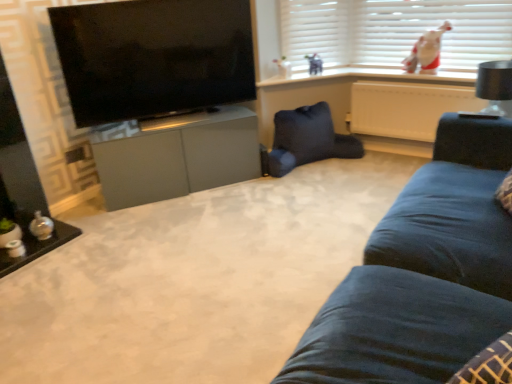
Looking at this image, measure the distance between point [370,45] and camera.

A distance of 3.30 meters exists between point [370,45] and camera.

What do you see at coordinates (153, 57) in the screenshot? I see `black glossy tv at upper left` at bounding box center [153, 57].

This screenshot has width=512, height=384. Describe the element at coordinates (178, 157) in the screenshot. I see `matte gray cabinet at center` at that location.

What do you see at coordinates (318, 31) in the screenshot? The width and height of the screenshot is (512, 384). I see `white matte shutter at upper center` at bounding box center [318, 31].

What are the coordinates of `white matte window blind at upper right` in the screenshot? It's located at (394, 31).

Is white plush toy at upper right to the left of white plastic radiator at upper right from the viewer's perspective?

Incorrect, white plush toy at upper right is not on the left side of white plastic radiator at upper right.

From the picture: From a real-world perspective, is white plush toy at upper right under white plastic radiator at upper right?

No, from a real-world perspective, white plush toy at upper right is not below white plastic radiator at upper right.

Based on the photo, considering the positions of objects white plush toy at upper right and white plastic radiator at upper right in the image provided, who is in front, white plush toy at upper right or white plastic radiator at upper right?

Positioned in front is white plastic radiator at upper right.

Can you tell me how much white plush toy at upper right and white plastic radiator at upper right differ in facing direction?

white plush toy at upper right and white plastic radiator at upper right are facing 0.00277 degrees away from each other.

Is white matte window blind at upper right next to black glossy tv at upper left?

No, white matte window blind at upper right is not in contact with black glossy tv at upper left.

Is white matte window blind at upper right taller or shorter than black glossy tv at upper left?

white matte window blind at upper right is shorter than black glossy tv at upper left.

Which of these two, white matte window blind at upper right or black glossy tv at upper left, is wider?

white matte window blind at upper right.

Is the depth of white matte window blind at upper right greater than that of black glossy tv at upper left?

Yes, the depth of white matte window blind at upper right is greater than that of black glossy tv at upper left.

Considering the positions of points (182, 91) and (352, 47), is point (182, 91) closer to camera compared to point (352, 47)?

Yes, point (182, 91) is in front of point (352, 47).

Looking at this image, are black glossy tv at upper left and white matte shutter at upper center making contact?

No, black glossy tv at upper left is not beside white matte shutter at upper center.

Can you confirm if black glossy tv at upper left is bigger than white matte shutter at upper center?

Indeed, black glossy tv at upper left has a larger size compared to white matte shutter at upper center.

Can you tell me how much black glossy tv at upper left and white matte shutter at upper center differ in facing direction?

black glossy tv at upper left and white matte shutter at upper center are facing 11.7 degrees away from each other.

Is white plush toy at upper right surrounded by black matte lampshade at upper right?

That's incorrect, white plush toy at upper right is not inside black matte lampshade at upper right.

Is point (475, 92) closer to camera compared to point (405, 62)?

Yes, it is in front of point (405, 62).

From a real-world perspective, who is located lower, black matte lampshade at upper right or white plush toy at upper right?

black matte lampshade at upper right, from a real-world perspective.

Where is `lamp that is in front of the matte gray cabinet at center`? The image size is (512, 384). lamp that is in front of the matte gray cabinet at center is located at coordinates (494, 85).

Considering the sizes of black matte lampshade at upper right and matte gray cabinet at center in the image, is black matte lampshade at upper right taller or shorter than matte gray cabinet at center?

Clearly, black matte lampshade at upper right is shorter compared to matte gray cabinet at center.

Consider the image. Is black matte lampshade at upper right completely or partially outside of matte gray cabinet at center?

Absolutely, black matte lampshade at upper right is external to matte gray cabinet at center.

Does black matte lampshade at upper right turn towards matte gray cabinet at center?

Yes, black matte lampshade at upper right is facing matte gray cabinet at center.

I want to click on lamp below the white plush toy at upper right (from a real-world perspective), so click(494, 85).

Considering the sizes of white plush toy at upper right and black matte lampshade at upper right in the image, is white plush toy at upper right bigger or smaller than black matte lampshade at upper right?

In the image, white plush toy at upper right appears to be smaller than black matte lampshade at upper right.

Considering the sizes of objects white plush toy at upper right and black matte lampshade at upper right in the image provided, who is thinner, white plush toy at upper right or black matte lampshade at upper right?

white plush toy at upper right.

Is white plush toy at upper right shorter than black matte lampshade at upper right?

In fact, white plush toy at upper right may be taller than black matte lampshade at upper right.

How many degrees apart are the facing directions of black glossy tv at upper left and white plush toy at upper right?

They differ by 56.2 degrees in their facing directions.

From the picture: Which object is more forward, black glossy tv at upper left or white plush toy at upper right?

black glossy tv at upper left is closer to the camera.

From a real-world perspective, is black glossy tv at upper left physically below white plush toy at upper right?

No, from a real-world perspective, black glossy tv at upper left is not under white plush toy at upper right.

Find the location of a particular element. person that is on the right side of white plastic radiator at upper right is located at coordinates (426, 51).

Where is `window blind that appears behind the black glossy tv at upper left`? This screenshot has width=512, height=384. window blind that appears behind the black glossy tv at upper left is located at coordinates (394, 31).

When comparing their distances from white plush toy at upper right, does black matte lampshade at upper right or white matte shutter at upper center seem closer?

black matte lampshade at upper right is positioned closer to the anchor white plush toy at upper right.

Based on their spatial positions, is white matte shutter at upper center or white matte window blind at upper right closer to white plush toy at upper center?

white matte shutter at upper center is closer to white plush toy at upper center.

From the image, which object appears to be farther from white matte window blind at upper right, white matte shutter at upper center or white plush toy at upper right?

Among the two, white plush toy at upper right is located further to white matte window blind at upper right.

Looking at the image, which one is located closer to black glossy tv at upper left, white plush toy at upper right or white matte shutter at upper center?

white matte shutter at upper center is closer to black glossy tv at upper left.

From the image, which object appears to be nearer to black glossy tv at upper left, white matte window blind at upper right or white plush toy at upper right?

white matte window blind at upper right is closer to black glossy tv at upper left.

Estimate the real-world distances between objects in this image. Which object is closer to dark blue fabric swivel chair at center, white plush toy at upper right or black matte lampshade at upper right?

Based on the image, white plush toy at upper right appears to be nearer to dark blue fabric swivel chair at center.

Estimate the real-world distances between objects in this image. Which object is closer to white plastic radiator at upper right, white plush toy at upper right or black matte lampshade at upper right?

Based on the image, white plush toy at upper right appears to be nearer to white plastic radiator at upper right.

Which object lies further to the anchor point white plastic radiator at upper right, white plush toy at upper center or black glossy tv at upper left?

black glossy tv at upper left lies further to white plastic radiator at upper right than the other object.

This screenshot has width=512, height=384. I want to click on person between matte gray cabinet at center and white matte window blind at upper right in the horizontal direction, so click(426, 51).

Where is `shutter situated between dark blue fabric swivel chair at center and white plush toy at upper right from left to right`? shutter situated between dark blue fabric swivel chair at center and white plush toy at upper right from left to right is located at coordinates coord(318,31).

Image resolution: width=512 pixels, height=384 pixels. Find the location of `toy situated between matte gray cabinet at center and white plush toy at upper right from left to right`. toy situated between matte gray cabinet at center and white plush toy at upper right from left to right is located at coordinates (314, 64).

The width and height of the screenshot is (512, 384). What are the coordinates of `radiator located between dark blue fabric swivel chair at center and white matte window blind at upper right in the left-right direction` in the screenshot? It's located at (406, 108).